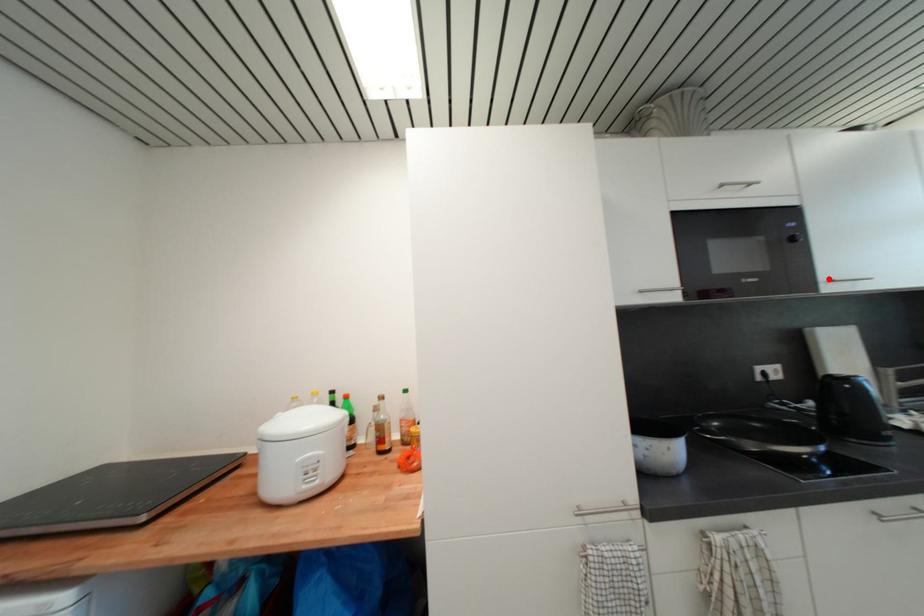
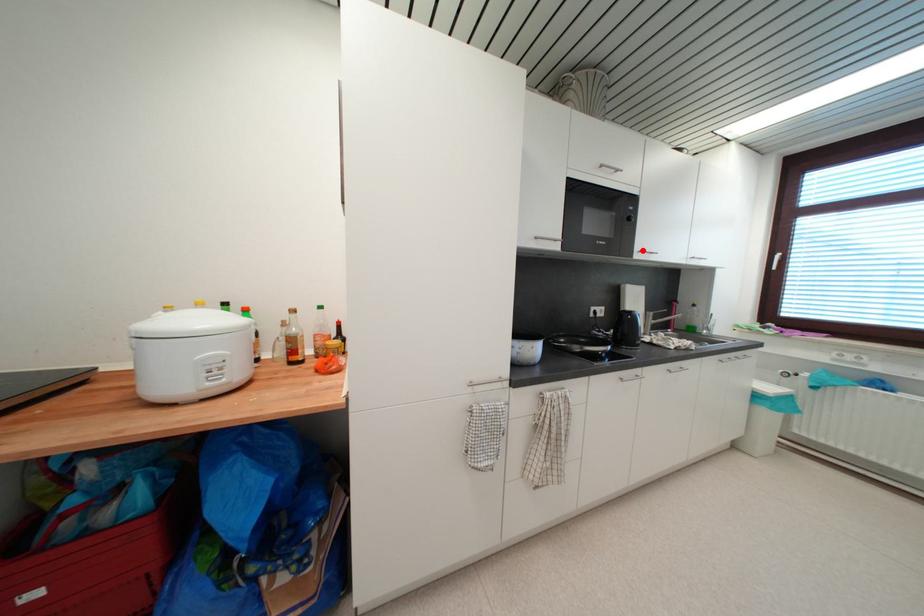
I am providing you with two images of the same scene from different viewpoints. A red point is marked on the first image and another point is marked on the second image. Does the point marked in image1 correspond to the same location as the one in image2?

Yes